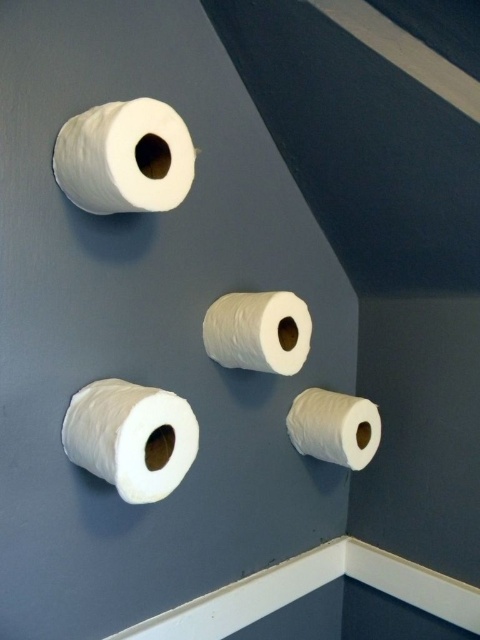
Looking at this image, you are trying to determine which item is taller between the white matte toilet paper at lower left and the white matte paper towel at center. Based on the scene, which one is taller?

The white matte toilet paper at lower left is taller than the white matte paper towel at center.

You are a decorator planning to hang two paper towels on a dark gray wall. You have a limited space between the white baseboard and the ceiling. Given that the white matte paper towel at upper left is larger than the white matte paper towel at center, which one should you place closer to the ceiling to maximize space efficiency?

The white matte paper towel at upper left is larger in size than the white matte paper towel at center, so placing the larger one closer to the ceiling will allow the smaller one to fit better within the available space between the baseboard and ceiling.